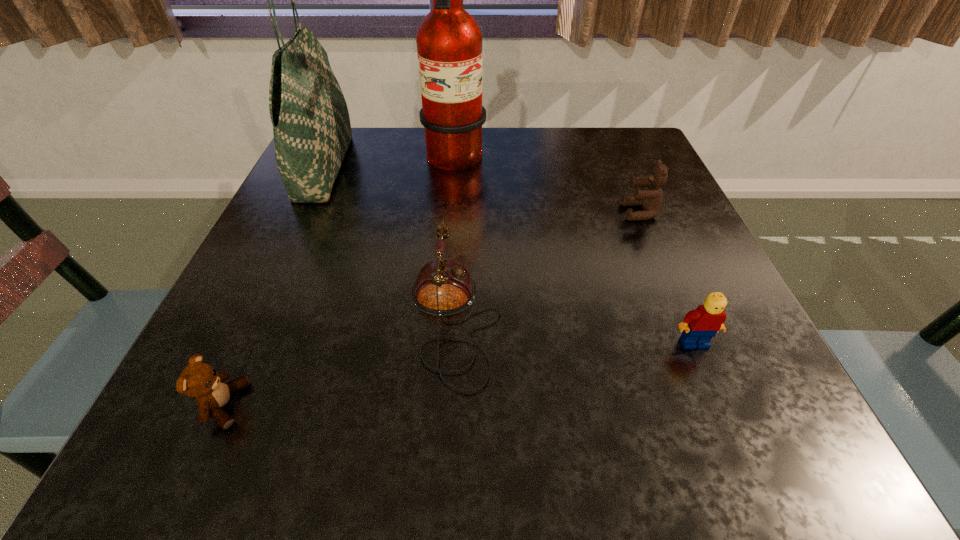
Where is `object that is the fifth closest one to the fire extinguisher`? The image size is (960, 540). object that is the fifth closest one to the fire extinguisher is located at coordinates (199, 380).